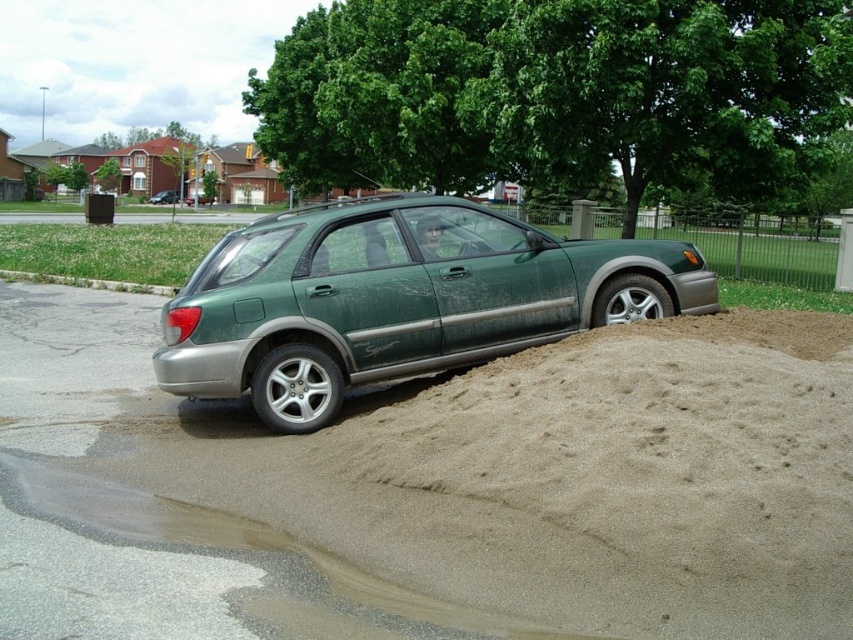
Question: Which object appears farthest from the camera in this image?

Choices:
 (A) green matte hatchback at center
 (B) gray concrete curb at lower left
 (C) green matte car at center

Answer: (A)

Question: Which point is farther from the camera taking this photo?

Choices:
 (A) (589, 266)
 (B) (161, 198)

Answer: (B)

Question: From the image, what is the correct spatial relationship of gray concrete curb at lower left in relation to green matte hatchback at center?

Choices:
 (A) above
 (B) below

Answer: (B)

Question: Does green matte car at center appear on the right side of green matte hatchback at center?

Choices:
 (A) yes
 (B) no

Answer: (A)

Question: Estimate the real-world distances between objects in this image. Which object is closer to the green matte car at center?

Choices:
 (A) green matte hatchback at center
 (B) gray concrete curb at lower left

Answer: (B)

Question: Is green matte car at center further to camera compared to green matte hatchback at center?

Choices:
 (A) no
 (B) yes

Answer: (A)